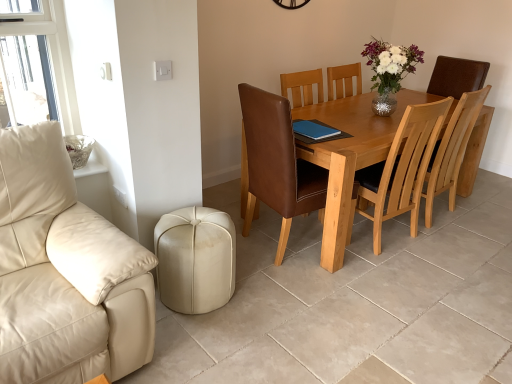
The image size is (512, 384). I want to click on vacant space to the right of blue leather pad at center, so click(354, 134).